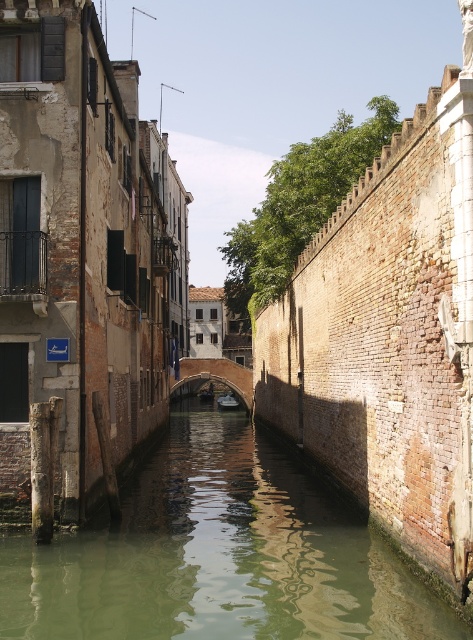
Is dark brown stone bridge at center wider than wooden boat at center?

Yes, dark brown stone bridge at center is wider than wooden boat at center.

Who is positioned more to the left, dark brown stone bridge at center or wooden boat at center?

Positioned to the left is dark brown stone bridge at center.

This screenshot has width=473, height=640. What do you see at coordinates (215, 376) in the screenshot?
I see `dark brown stone bridge at center` at bounding box center [215, 376].

Locate an element on the screen. Image resolution: width=473 pixels, height=640 pixels. dark brown stone bridge at center is located at coordinates (215, 376).

From the picture: Is greenish water at center below wooden boat at center?

No, greenish water at center is not below wooden boat at center.

Can you confirm if greenish water at center is positioned to the left of wooden boat at center?

In fact, greenish water at center is to the right of wooden boat at center.

Locate an element on the screen. This screenshot has width=473, height=640. greenish water at center is located at coordinates (218, 554).

What do you see at coordinates (218, 554) in the screenshot? This screenshot has height=640, width=473. I see `greenish water at center` at bounding box center [218, 554].

Who is more forward, (115,628) or (226,364)?

Point (115,628) is more forward.

This screenshot has height=640, width=473. Find the location of `greenish water at center`. greenish water at center is located at coordinates (218, 554).